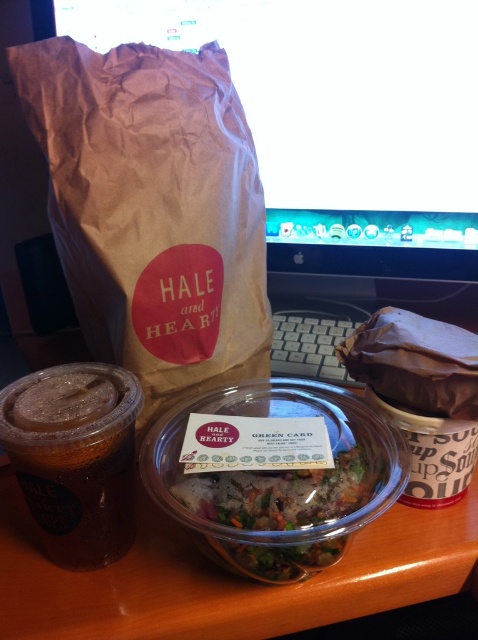
Question: Among these objects, which one is farthest from the camera?

Choices:
 (A) brown paper bag at upper left
 (B) translucent plastic cup at left
 (C) clear plastic container at center

Answer: (A)

Question: Which object is farther from the camera taking this photo?

Choices:
 (A) translucent plastic cup at left
 (B) clear plastic container at center

Answer: (B)

Question: Is brown paper bag at upper left smaller than clear plastic container at center?

Choices:
 (A) no
 (B) yes

Answer: (B)

Question: Can you confirm if brown paper bag at upper left is positioned to the left of translucent plastic cup at left?

Choices:
 (A) no
 (B) yes

Answer: (A)

Question: Can you confirm if brown paper bag at upper left is positioned to the right of translucent plastic cup at left?

Choices:
 (A) yes
 (B) no

Answer: (A)

Question: Among these points, which one is farthest from the camera?

Choices:
 (A) (56, 403)
 (B) (14, 45)
 (C) (382, 564)

Answer: (B)